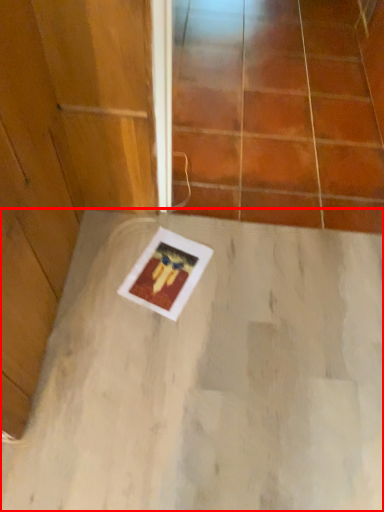
Question: From the image's perspective, where is concrete (annotated by the red box) located relative to glass door?

Choices:
 (A) below
 (B) above

Answer: (A)